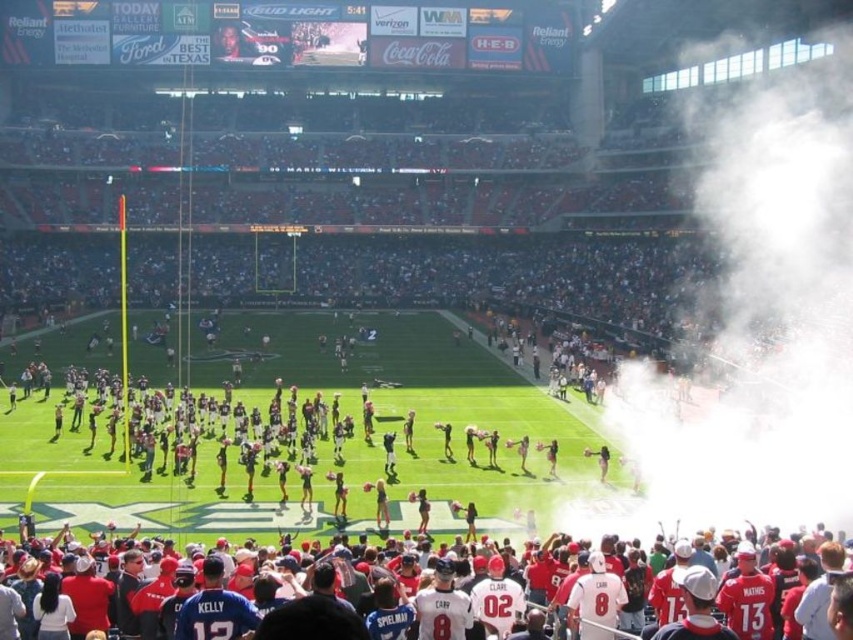
You are a photographer trying to capture the entire scene of the football stadium. You notice the white fog at right and the red jersey fans at lower center. Based on their sizes in the image, which object would appear larger in your photo?

The white fog at right might be wider than red jersey fans at lower center, so it would likely appear larger in the photo.

You are a photographer at the stadium and want to capture a photo that includes both the white fog at right and the red jersey fans at lower center. Which object should you focus on first if you want to ensure both are in the frame without moving the camera?

You should focus on the white fog at right first since it is larger in size compared to the red jersey fans at lower center, making it easier to frame both objects by centering the larger one first.